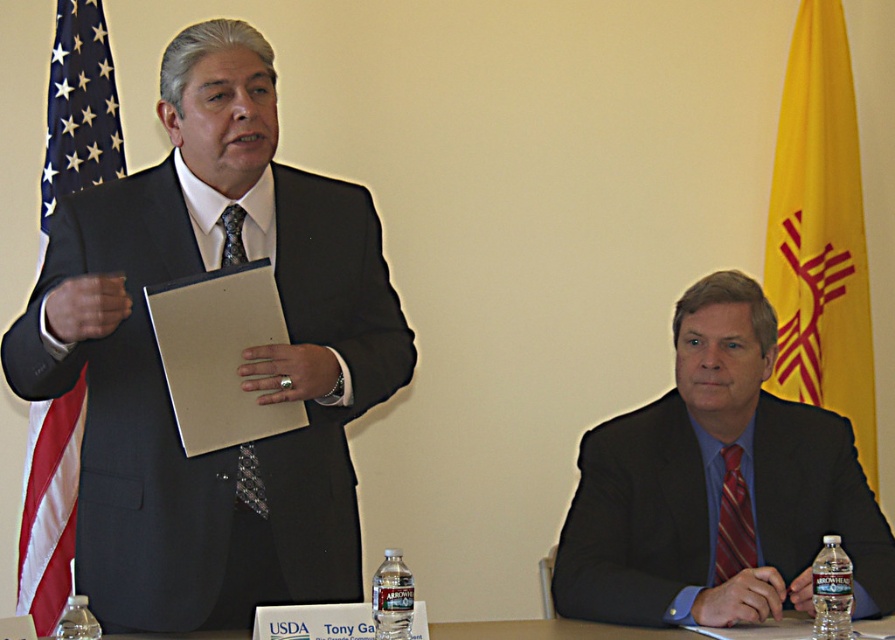
You are attending a virtual meeting and need to present your slides. You want to ensure your presentation is visible to the audience. Which object, the matte black suit at right or the american flag at left, is closer to the camera?

The matte black suit at right is closer to the camera than the american flag at left because it is in front of the american flag at left.

You are a photographer in a meeting room. You need to take a photo of the yellow fabric flag at upper right and the striped silk tie at right. The camera can only focus on objects within 3 feet of each other. Will both objects be in focus?

The yellow fabric flag at upper right and striped silk tie at right are 3.80 feet apart. Since the camera requires objects to be within 3 feet of each other to focus, the distance between them exceeds the limit, so they cannot both be in focus.

You are an event planner arranging chairs for a presentation. The matte black suit at left is standing, and the striped silk tie at right is seated. Which object occupies more horizontal space in the scene?

The matte black suit at left is wider than striped silk tie at right, so the matte black suit at left occupies more horizontal space in the scene.